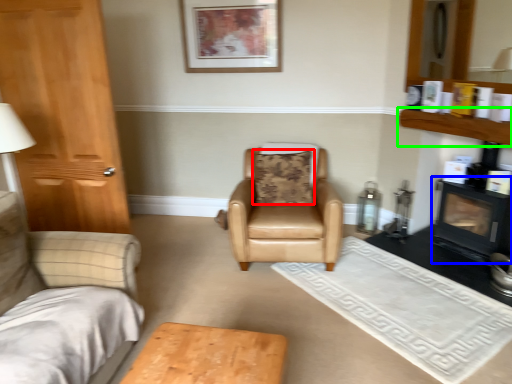
Question: Which is farther away from pillow (highlighted by a red box)? fireplace (highlighted by a blue box) or shelf (highlighted by a green box)?

Choices:
 (A) fireplace
 (B) shelf

Answer: (A)